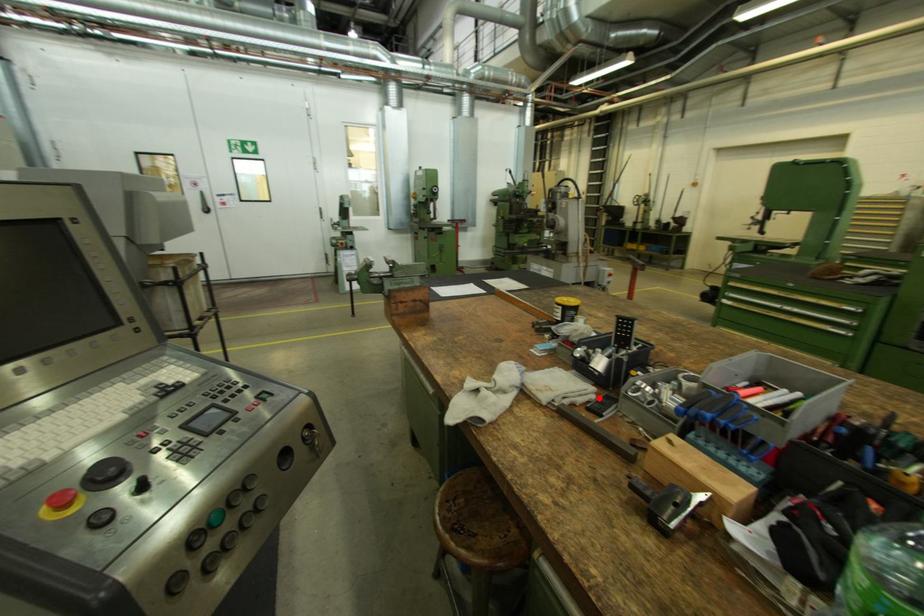
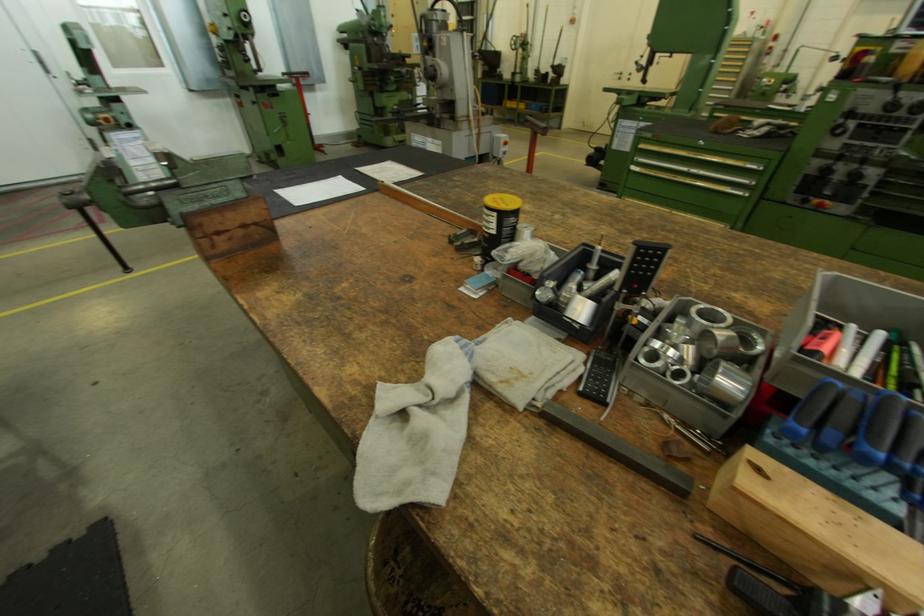
Locate, in the second image, the point that corresponds to the highlighted location in the first image.

(589, 370)